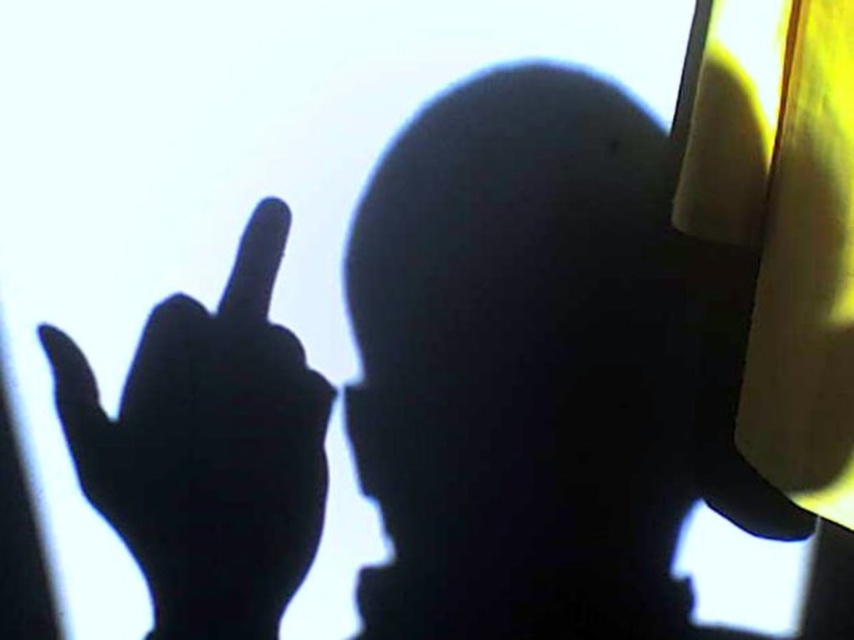
Question: Which of the following is the closest to the observer?

Choices:
 (A) smooth yellow helmet at center
 (B) black matte hand at upper left

Answer: (A)

Question: Is smooth yellow helmet at center below black matte hand at upper left?

Choices:
 (A) yes
 (B) no

Answer: (B)

Question: Does smooth yellow helmet at center have a larger size compared to black matte hand at upper left?

Choices:
 (A) yes
 (B) no

Answer: (A)

Question: Can you confirm if smooth yellow helmet at center is positioned above black matte hand at upper left?

Choices:
 (A) yes
 (B) no

Answer: (A)